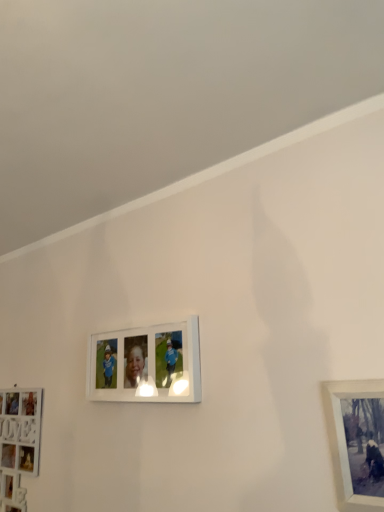
Describe the element at coordinates (345, 441) in the screenshot. I see `metallic silver frame at lower right, the 3th picture frame from the back` at that location.

At what (x,y) coordinates should I click in order to perform the action: click on white matte picture frame at lower left, which appears as the first picture frame when viewed from the back. Please return your answer as a coordinate pair (x, y). Image resolution: width=384 pixels, height=512 pixels. Looking at the image, I should click on (20, 429).

From the picture: Considering the sizes of objects white matte picture frame at lower left, which appears as the first picture frame when viewed from the back, and white glossy picture frame at center, the 2th picture frame viewed from the front, in the image provided, who is shorter, white matte picture frame at lower left, which appears as the first picture frame when viewed from the back, or white glossy picture frame at center, the 2th picture frame viewed from the front,?

white glossy picture frame at center, the 2th picture frame viewed from the front, is shorter.

Does white matte picture frame at lower left, the first picture frame positioned from the left, come in front of white glossy picture frame at center, the 2th picture frame from the left?

No, the depth of white matte picture frame at lower left, the first picture frame positioned from the left, is greater than that of white glossy picture frame at center, the 2th picture frame from the left.

Is white matte picture frame at lower left, which is the 3th picture frame in right-to-left order, positioned with its back to white glossy picture frame at center, the 2th picture frame viewed from the front?

That's not correct — white matte picture frame at lower left, which is the 3th picture frame in right-to-left order, is not looking away from white glossy picture frame at center, the 2th picture frame viewed from the front.

Considering the sizes of white matte picture frame at lower left, the first picture frame positioned from the left, and white glossy picture frame at center, which ranks as the second picture frame in right-to-left order, in the image, is white matte picture frame at lower left, the first picture frame positioned from the left, bigger or smaller than white glossy picture frame at center, which ranks as the second picture frame in right-to-left order,?

Considering their sizes, white matte picture frame at lower left, the first picture frame positioned from the left, takes up more space than white glossy picture frame at center, which ranks as the second picture frame in right-to-left order.

Is metallic silver frame at lower right, which appears as the first picture frame when viewed from the right, to the right of white glossy picture frame at center, the 2th picture frame from the left, from the viewer's perspective?

Correct, you'll find metallic silver frame at lower right, which appears as the first picture frame when viewed from the right, to the right of white glossy picture frame at center, the 2th picture frame from the left.

From the image's perspective, starting from the white glossy picture frame at center, which appears as the 2th picture frame when viewed from the back, which picture frame is the 1st one below? Please provide its 2D coordinates.

[(345, 441)]

From the image's perspective, relative to white glossy picture frame at center, the 2th picture frame from the left, is metallic silver frame at lower right, marked as the 1th picture frame in a front-to-back arrangement, above or below?

From the image's perspective, metallic silver frame at lower right, marked as the 1th picture frame in a front-to-back arrangement, appears below white glossy picture frame at center, the 2th picture frame from the left.

In terms of width, does metallic silver frame at lower right, which appears as the first picture frame when viewed from the right, look wider or thinner when compared to white glossy picture frame at center, the 2th picture frame viewed from the front?

Clearly, metallic silver frame at lower right, which appears as the first picture frame when viewed from the right, has less width compared to white glossy picture frame at center, the 2th picture frame viewed from the front.

From the picture: Can you confirm if white matte picture frame at lower left, which is the 3th picture frame in right-to-left order, is bigger than metallic silver frame at lower right, marked as the 1th picture frame in a front-to-back arrangement?

Correct, white matte picture frame at lower left, which is the 3th picture frame in right-to-left order, is larger in size than metallic silver frame at lower right, marked as the 1th picture frame in a front-to-back arrangement.

What's the angular difference between white matte picture frame at lower left, which is the 3th picture frame in right-to-left order, and metallic silver frame at lower right, which appears as the first picture frame when viewed from the right,'s facing directions?

1.46 degrees separate the facing orientations of white matte picture frame at lower left, which is the 3th picture frame in right-to-left order, and metallic silver frame at lower right, which appears as the first picture frame when viewed from the right.

Consider the image. From a real-world perspective, is white matte picture frame at lower left, the 3th picture frame from the front, under metallic silver frame at lower right, which appears as the first picture frame when viewed from the right?

Yes, from a real-world perspective, white matte picture frame at lower left, the 3th picture frame from the front, is below metallic silver frame at lower right, which appears as the first picture frame when viewed from the right.

Could you tell me if white matte picture frame at lower left, which is the 3th picture frame in right-to-left order, is turned towards metallic silver frame at lower right, the third picture frame from the left?

No, white matte picture frame at lower left, which is the 3th picture frame in right-to-left order, does not turn towards metallic silver frame at lower right, the third picture frame from the left.

Can you confirm if white glossy picture frame at center, which ranks as the second picture frame in right-to-left order, is thinner than metallic silver frame at lower right, the 3th picture frame from the back?

No, white glossy picture frame at center, which ranks as the second picture frame in right-to-left order, is not thinner than metallic silver frame at lower right, the 3th picture frame from the back.

Is white glossy picture frame at center, the 2th picture frame from the left, behind metallic silver frame at lower right, the third picture frame from the left?

Yes, white glossy picture frame at center, the 2th picture frame from the left, is further from the viewer.

How many degrees apart are the facing directions of white glossy picture frame at center, which appears as the 2th picture frame when viewed from the back, and metallic silver frame at lower right, which appears as the first picture frame when viewed from the right?

There is a 1.54-degree angle between the facing directions of white glossy picture frame at center, which appears as the 2th picture frame when viewed from the back, and metallic silver frame at lower right, which appears as the first picture frame when viewed from the right.

Can you see white glossy picture frame at center, which appears as the 2th picture frame when viewed from the back, touching metallic silver frame at lower right, which appears as the first picture frame when viewed from the right?

They are not placed beside each other.

Which is farther, [122,392] or [38,413]?

The point [38,413] is more distant.

Considering the relative positions of white glossy picture frame at center, the 2th picture frame viewed from the front, and white matte picture frame at lower left, which is the 3th picture frame in right-to-left order, in the image provided, is white glossy picture frame at center, the 2th picture frame viewed from the front, behind white matte picture frame at lower left, which is the 3th picture frame in right-to-left order,?

No, it is not.

Is white glossy picture frame at center, the 2th picture frame viewed from the front, smaller than white matte picture frame at lower left, which appears as the first picture frame when viewed from the back?

Correct, white glossy picture frame at center, the 2th picture frame viewed from the front, occupies less space than white matte picture frame at lower left, which appears as the first picture frame when viewed from the back.

Can you tell me how much white glossy picture frame at center, the 2th picture frame viewed from the front, and white matte picture frame at lower left, the first picture frame positioned from the left, differ in facing direction?

The facing directions of white glossy picture frame at center, the 2th picture frame viewed from the front, and white matte picture frame at lower left, the first picture frame positioned from the left, are 0.0808 degrees apart.

Between metallic silver frame at lower right, which appears as the first picture frame when viewed from the right, and white matte picture frame at lower left, the 3th picture frame from the front, which one has smaller width?

metallic silver frame at lower right, which appears as the first picture frame when viewed from the right.

In the scene shown: Which is nearer, (342, 389) or (33, 399)?

Clearly, point (342, 389) is closer to the camera than point (33, 399).

Considering the relative sizes of metallic silver frame at lower right, the 3th picture frame from the back, and white matte picture frame at lower left, the 3th picture frame from the front, in the image provided, is metallic silver frame at lower right, the 3th picture frame from the back, shorter than white matte picture frame at lower left, the 3th picture frame from the front,?

Yes, metallic silver frame at lower right, the 3th picture frame from the back, is shorter than white matte picture frame at lower left, the 3th picture frame from the front.

Based on the photo, can you tell me how much metallic silver frame at lower right, marked as the 1th picture frame in a front-to-back arrangement, and white matte picture frame at lower left, which is the 3th picture frame in right-to-left order, differ in facing direction?

There is a 1.46-degree angle between the facing directions of metallic silver frame at lower right, marked as the 1th picture frame in a front-to-back arrangement, and white matte picture frame at lower left, which is the 3th picture frame in right-to-left order.

Locate an element on the screen. This screenshot has width=384, height=512. the 1st picture frame in front of the white matte picture frame at lower left, which appears as the first picture frame when viewed from the back is located at coordinates (146, 364).

The image size is (384, 512). What are the coordinates of `picture frame located on the right of white glossy picture frame at center, which ranks as the second picture frame in right-to-left order` in the screenshot? It's located at tap(345, 441).

Considering their positions, is white glossy picture frame at center, the 2th picture frame viewed from the front, positioned closer to white matte picture frame at lower left, which appears as the first picture frame when viewed from the back, than metallic silver frame at lower right, marked as the 1th picture frame in a front-to-back arrangement?

The object closer to white matte picture frame at lower left, which appears as the first picture frame when viewed from the back, is white glossy picture frame at center, the 2th picture frame viewed from the front.

When comparing their distances from metallic silver frame at lower right, marked as the 1th picture frame in a front-to-back arrangement, does white glossy picture frame at center, the 2th picture frame from the left, or white matte picture frame at lower left, the 3th picture frame from the front, seem closer?

Among the two, white glossy picture frame at center, the 2th picture frame from the left, is located nearer to metallic silver frame at lower right, marked as the 1th picture frame in a front-to-back arrangement.

From the image, which object appears to be nearer to white glossy picture frame at center, which appears as the 2th picture frame when viewed from the back, white matte picture frame at lower left, which appears as the first picture frame when viewed from the back, or metallic silver frame at lower right, the 3th picture frame from the back?

The object closer to white glossy picture frame at center, which appears as the 2th picture frame when viewed from the back, is white matte picture frame at lower left, which appears as the first picture frame when viewed from the back.

Which object lies further to the anchor point metallic silver frame at lower right, the 3th picture frame from the back, white matte picture frame at lower left, which appears as the first picture frame when viewed from the back, or white glossy picture frame at center, which appears as the 2th picture frame when viewed from the back?

white matte picture frame at lower left, which appears as the first picture frame when viewed from the back.

In the scene shown: Considering their positions, is metallic silver frame at lower right, marked as the 1th picture frame in a front-to-back arrangement, positioned closer to white matte picture frame at lower left, the 3th picture frame from the front, than white glossy picture frame at center, the 2th picture frame from the left?

white glossy picture frame at center, the 2th picture frame from the left, is closer to white matte picture frame at lower left, the 3th picture frame from the front.

Based on the photo, based on their spatial positions, is metallic silver frame at lower right, the third picture frame from the left, or white matte picture frame at lower left, the 3th picture frame from the front, further from white glossy picture frame at center, which ranks as the second picture frame in right-to-left order?

Among the two, metallic silver frame at lower right, the third picture frame from the left, is located further to white glossy picture frame at center, which ranks as the second picture frame in right-to-left order.

Locate an element on the screen. picture frame between white matte picture frame at lower left, which appears as the first picture frame when viewed from the back, and metallic silver frame at lower right, the 3th picture frame from the back, in the horizontal direction is located at coordinates (146, 364).